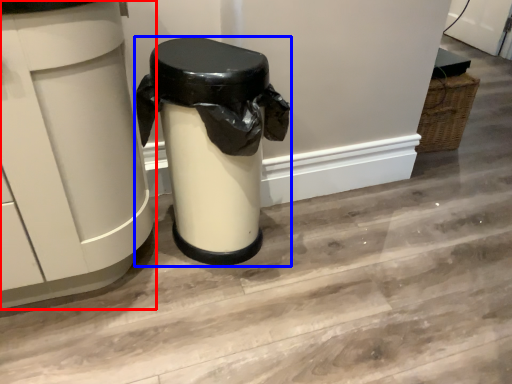
Question: Which point is further to the camera, waste container (highlighted by a red box) or waste container (highlighted by a blue box)?

Choices:
 (A) waste container
 (B) waste container

Answer: (B)